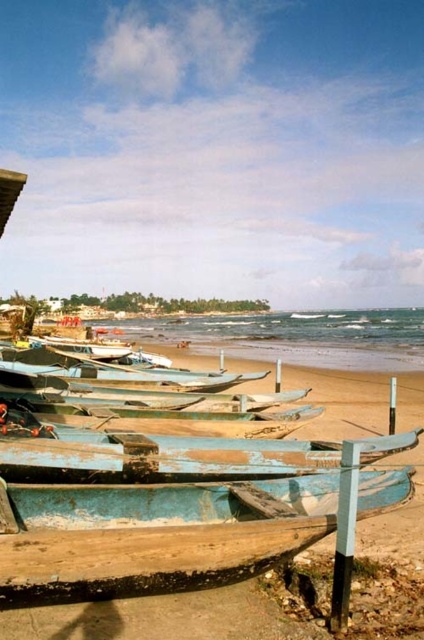
Question: Which object is closer to the camera taking this photo?

Choices:
 (A) blue wooden boats at lower center
 (B) blue weathered boat at lower center

Answer: (A)

Question: Is blue wooden boats at lower center smaller than blue weathered wood boat at lower center?

Choices:
 (A) no
 (B) yes

Answer: (A)

Question: Which point is closer to the camera?

Choices:
 (A) (66, 448)
 (B) (301, 353)
 (C) (105, 502)

Answer: (C)

Question: Does blue weathered wood boat at lower center have a lesser width compared to blue weathered boat at lower center?

Choices:
 (A) no
 (B) yes

Answer: (B)

Question: Can you confirm if blue wooden boats at lower center is smaller than blue weathered boat at lower center?

Choices:
 (A) yes
 (B) no

Answer: (B)

Question: Which point is closer to the camera?

Choices:
 (A) blue weathered boat at lower center
 (B) blue weathered wood boat at lower center

Answer: (B)